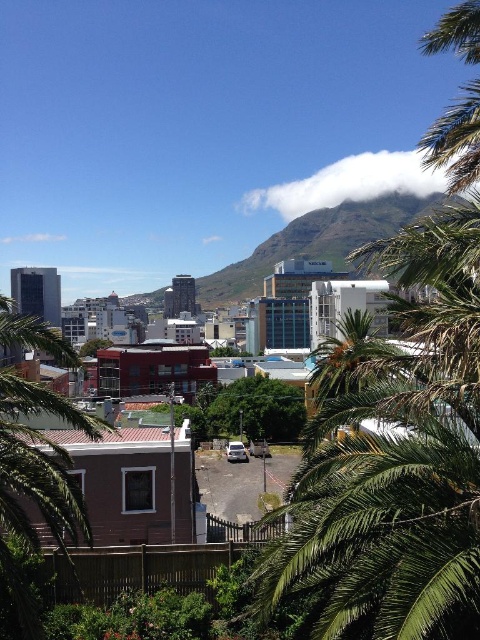
What do you see at coordinates (316, 241) in the screenshot?
I see `green grassy mountain at center` at bounding box center [316, 241].

From the picture: Can you confirm if green grassy mountain at center is taller than white fluffy cloud at upper center?

Indeed, green grassy mountain at center has a greater height compared to white fluffy cloud at upper center.

Does point (325, 225) come behind point (343, 182)?

No, it is not.

Identify the location of green grassy mountain at center. The width and height of the screenshot is (480, 640). (316, 241).

Who is more distant from viewer, (446, 387) or (431, 182)?

The point (431, 182) is more distant.

Does green leafy palm tree at center lie in front of white fluffy cloud at upper center?

Yes, green leafy palm tree at center is closer to the viewer.

Does point (446, 237) come closer to viewer compared to point (403, 170)?

Yes, point (446, 237) is in front of point (403, 170).

Find the location of a particular element. green leafy palm tree at center is located at coordinates (395, 456).

Who is positioned more to the left, green leafy palm tree at center or green grassy mountain at center?

From the viewer's perspective, green grassy mountain at center appears more on the left side.

Which is above, green leafy palm tree at center or green grassy mountain at center?

green grassy mountain at center is above.

Is point (468, 396) positioned before point (225, 288)?

Yes, point (468, 396) is closer to viewer.

This screenshot has height=640, width=480. Find the location of `green leafy palm tree at center`. green leafy palm tree at center is located at coordinates (395, 456).